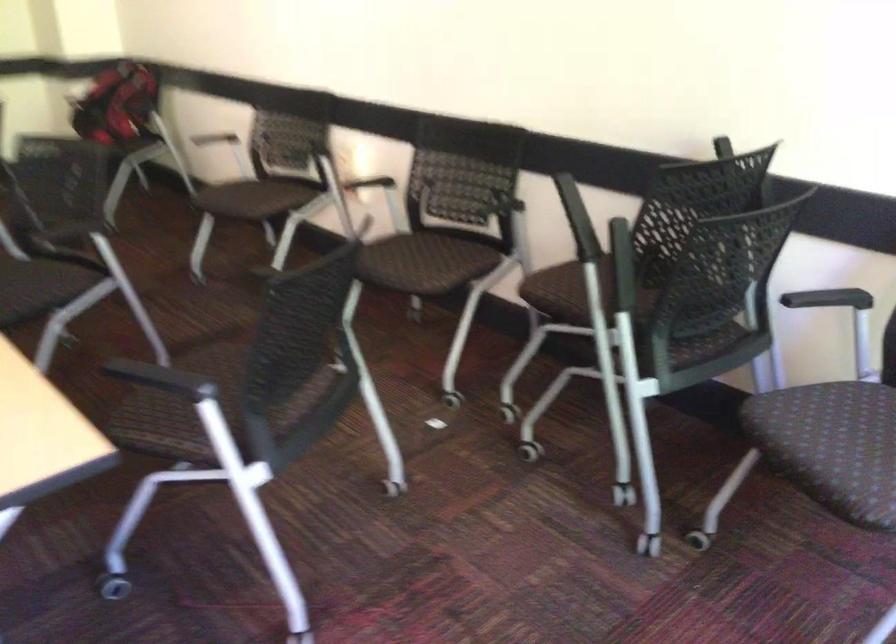
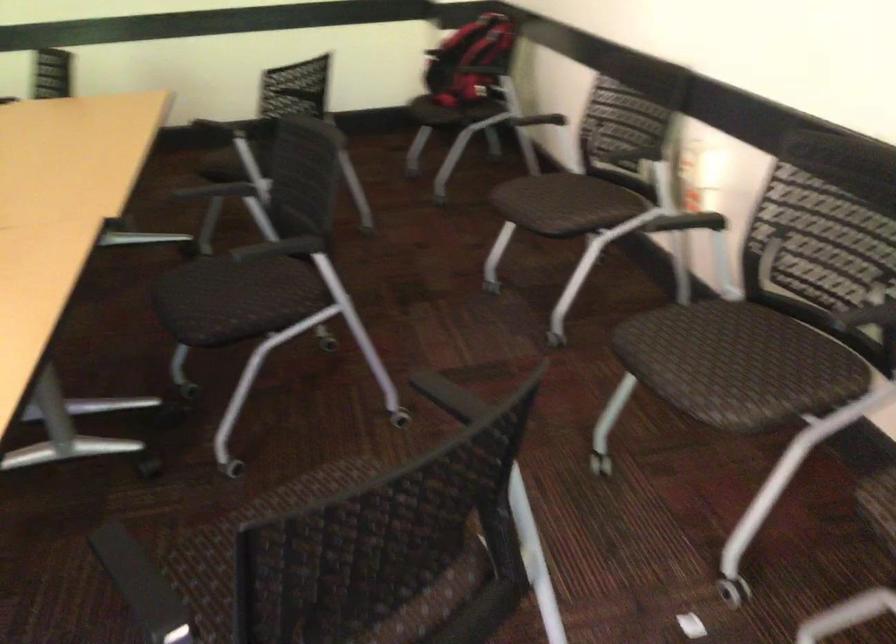
Question: What movement of the cameraman would produce the second image?

Choices:
 (A) Left
 (B) Right
 (C) Forward
 (D) Backward

Answer: (C)